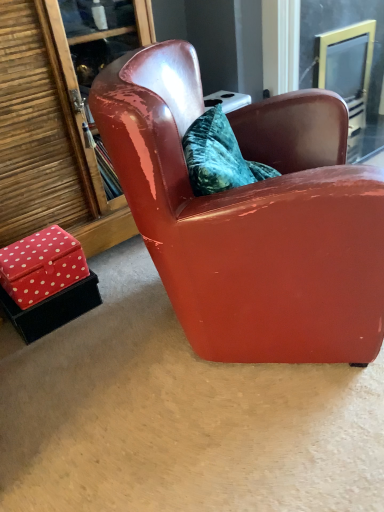
You are a GUI agent. You are given a task and a screenshot of the screen. Output one action in this format:
    pyautogui.click(x=<x>, y=<y>)
    Task: Click on the vacant space that is in between glossy leather armchair at center and red polka dot fabric box at lower left, placed as the 2th box when sorted from top to bottom
    This screenshot has height=512, width=384.
    Given the screenshot: What is the action you would take?
    pyautogui.click(x=112, y=316)